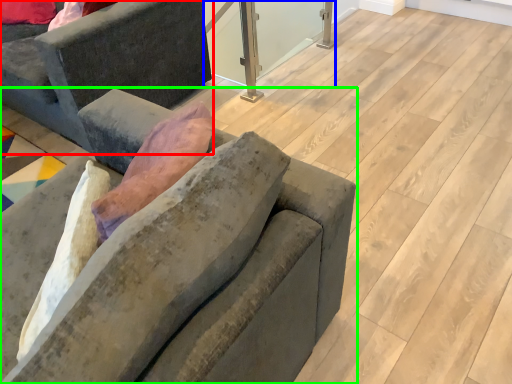
Question: Estimate the real-world distances between objects in this image. Which object is farther from studio couch (highlighted by a red box), window screen (highlighted by a blue box) or studio couch (highlighted by a green box)?

Choices:
 (A) window screen
 (B) studio couch

Answer: (A)